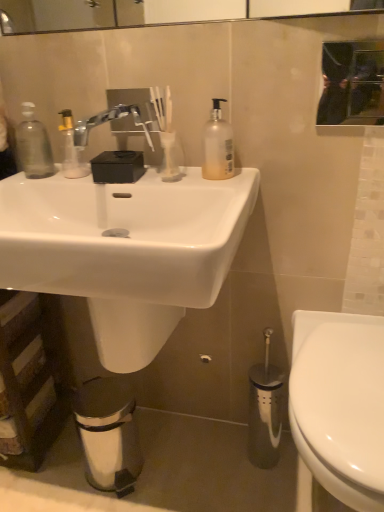
Question: From the image's perspective, is translucent plastic pump bottle at upper center on top of white glossy sink at center?

Choices:
 (A) no
 (B) yes

Answer: (B)

Question: From a real-world perspective, is translucent plastic pump bottle at upper center positioned under white glossy sink at center based on gravity?

Choices:
 (A) no
 (B) yes

Answer: (A)

Question: Is translucent plastic pump bottle at upper center not close to white glossy sink at center?

Choices:
 (A) yes
 (B) no

Answer: (B)

Question: Is translucent plastic pump bottle at upper center wider than white glossy sink at center?

Choices:
 (A) no
 (B) yes

Answer: (A)

Question: From a real-world perspective, is translucent plastic pump bottle at upper center on white glossy sink at center?

Choices:
 (A) no
 (B) yes

Answer: (B)

Question: Does translucent plastic pump bottle at upper center have a greater height compared to white glossy sink at center?

Choices:
 (A) no
 (B) yes

Answer: (A)

Question: Is transparent plastic soap dispenser at left further to the viewer compared to white glossy sink at center?

Choices:
 (A) no
 (B) yes

Answer: (B)

Question: From a real-world perspective, is transparent plastic soap dispenser at left positioned under white glossy sink at center based on gravity?

Choices:
 (A) yes
 (B) no

Answer: (B)

Question: Is transparent plastic soap dispenser at left to the right of white glossy sink at center from the viewer's perspective?

Choices:
 (A) yes
 (B) no

Answer: (B)

Question: Considering the relative sizes of transparent plastic soap dispenser at left and white glossy sink at center in the image provided, is transparent plastic soap dispenser at left taller than white glossy sink at center?

Choices:
 (A) no
 (B) yes

Answer: (A)

Question: Can you confirm if transparent plastic soap dispenser at left is smaller than white glossy sink at center?

Choices:
 (A) no
 (B) yes

Answer: (B)

Question: From a real-world perspective, is transparent plastic soap dispenser at left located higher than white glossy sink at center?

Choices:
 (A) no
 (B) yes

Answer: (B)

Question: Can you confirm if satin nickel faucet at upper center is shorter than black glass mirror at upper center?

Choices:
 (A) no
 (B) yes

Answer: (B)